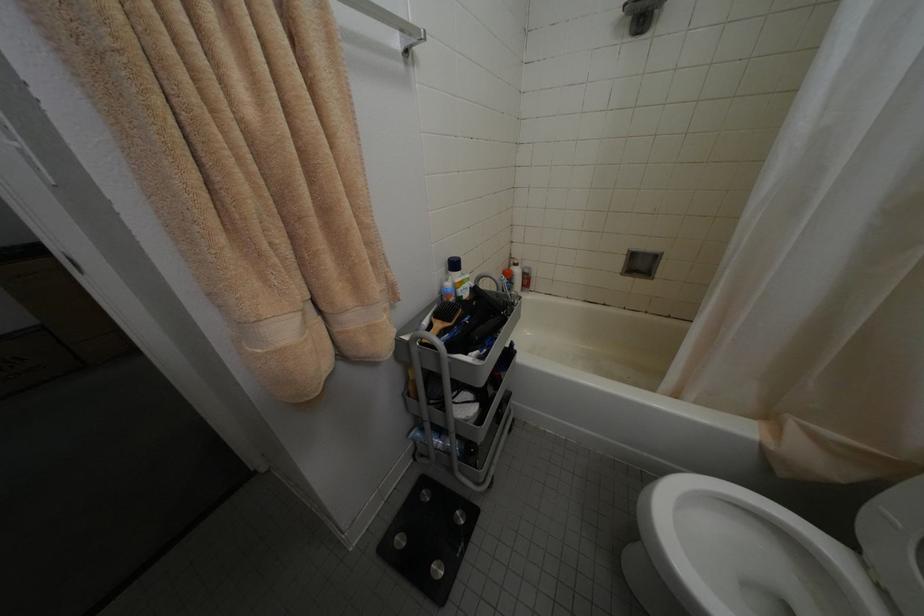
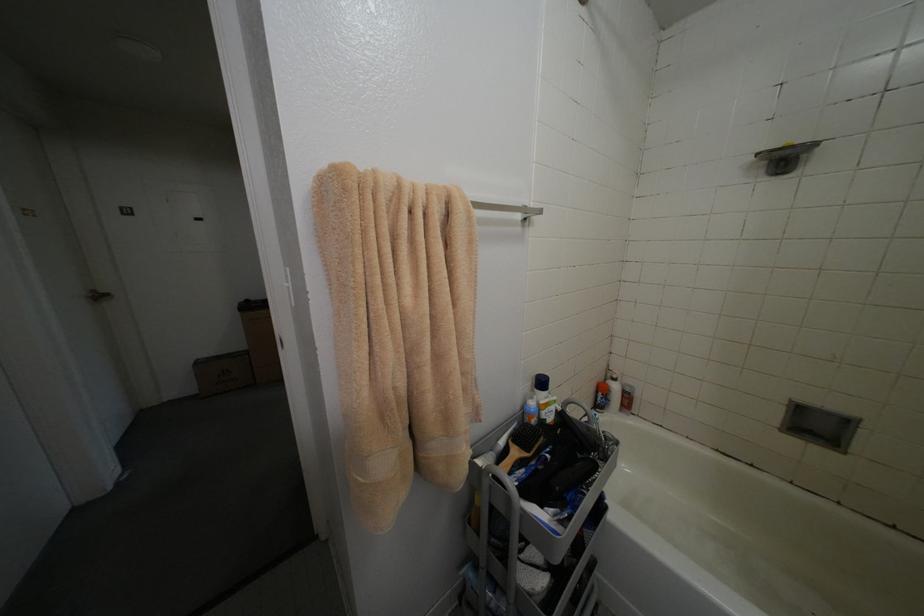
Question: The images are taken continuously from a first-person perspective. In which direction are you moving?

Choices:
 (A) Left
 (B) Right
 (C) Forward
 (D) Backward

Answer: (D)